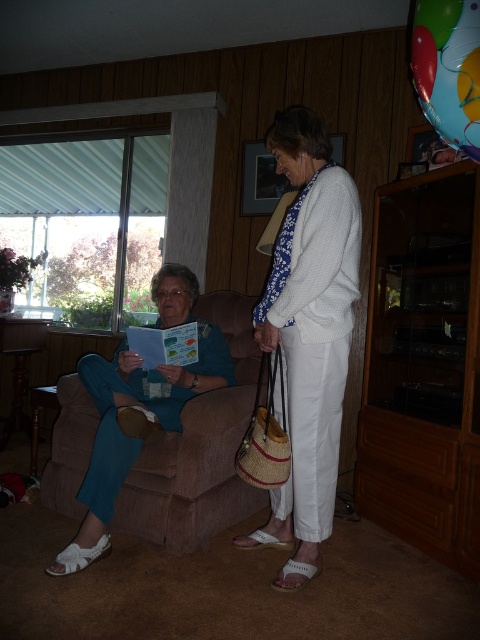
Describe the element at coordinates (199, 451) in the screenshot. I see `brown fabric couch at lower left` at that location.

From the picture: Is brown fabric couch at lower left further to the viewer compared to translucent plastic balloon at upper right?

Yes.

Is point (240, 417) positioned before point (460, 36)?

No.

Locate an element on the screen. Image resolution: width=480 pixels, height=640 pixels. brown fabric couch at lower left is located at coordinates (199, 451).

Is matte blue pants at left to the right of white woven purse at center from the viewer's perspective?

No, matte blue pants at left is not to the right of white woven purse at center.

Based on the photo, does matte blue pants at left appear over white woven purse at center?

Incorrect, matte blue pants at left is not positioned above white woven purse at center.

Which is in front, point (307, 472) or point (332, 196)?

Point (332, 196) is in front.

You are a GUI agent. You are given a task and a screenshot of the screen. Output one action in this format:
    pyautogui.click(x=<x>, y=<y>)
    Task: Click on the matte blue pants at left
    This screenshot has height=640, width=480.
    Given the screenshot: What is the action you would take?
    pyautogui.click(x=309, y=336)

Identify the location of white woven purse at center. The height and width of the screenshot is (640, 480). (309, 336).

Can you confirm if white woven purse at center is positioned below translucent plastic balloon at upper right?

Correct, white woven purse at center is located below translucent plastic balloon at upper right.

This screenshot has height=640, width=480. Describe the element at coordinates (309, 336) in the screenshot. I see `white woven purse at center` at that location.

Locate an element on the screen. white woven purse at center is located at coordinates [309, 336].